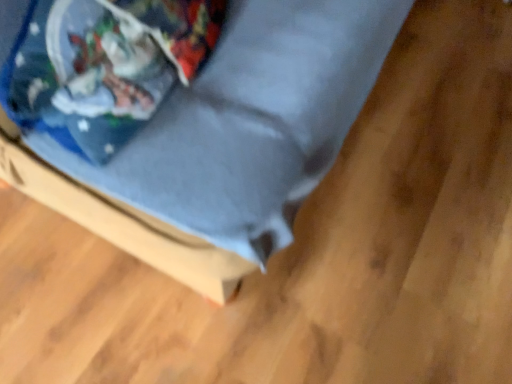
Question: Looking at the image, does blue fabric bag at upper left seem bigger or smaller compared to matte blue cushion at center?

Choices:
 (A) big
 (B) small

Answer: (B)

Question: In terms of width, does blue fabric bag at upper left look wider or thinner when compared to matte blue cushion at center?

Choices:
 (A) wide
 (B) thin

Answer: (B)

Question: Considering the positions of point (87, 72) and point (32, 178), is point (87, 72) closer or farther from the camera than point (32, 178)?

Choices:
 (A) closer
 (B) farther

Answer: (A)

Question: Would you say matte blue cushion at center is to the left or to the right of blue fabric bag at upper left in the picture?

Choices:
 (A) right
 (B) left

Answer: (A)

Question: Choose the correct answer: Is matte blue cushion at center inside blue fabric bag at upper left or outside it?

Choices:
 (A) inside
 (B) outside

Answer: (B)

Question: Is point (242, 228) closer or farther from the camera than point (24, 44)?

Choices:
 (A) closer
 (B) farther

Answer: (A)

Question: Is matte blue cushion at center bigger or smaller than blue fabric bag at upper left?

Choices:
 (A) small
 (B) big

Answer: (B)